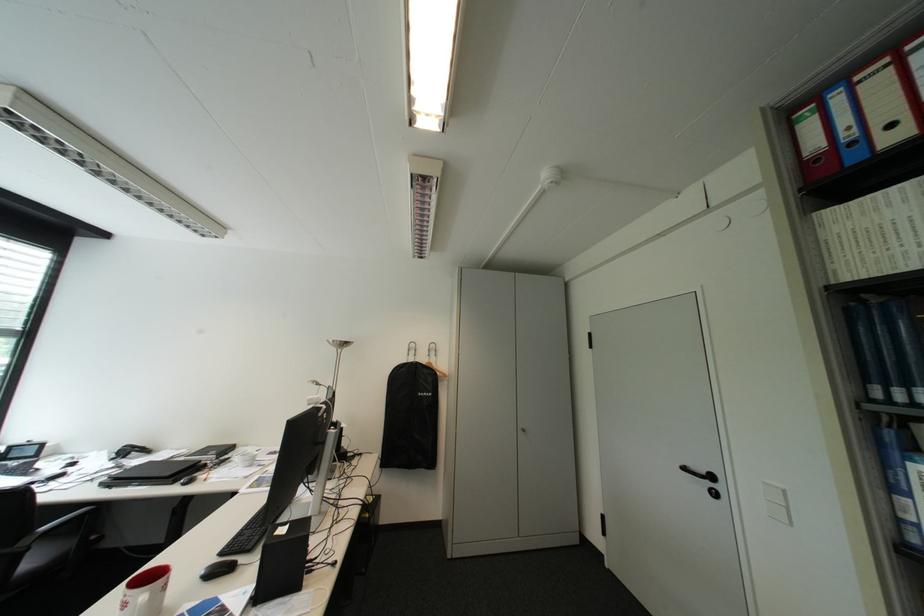
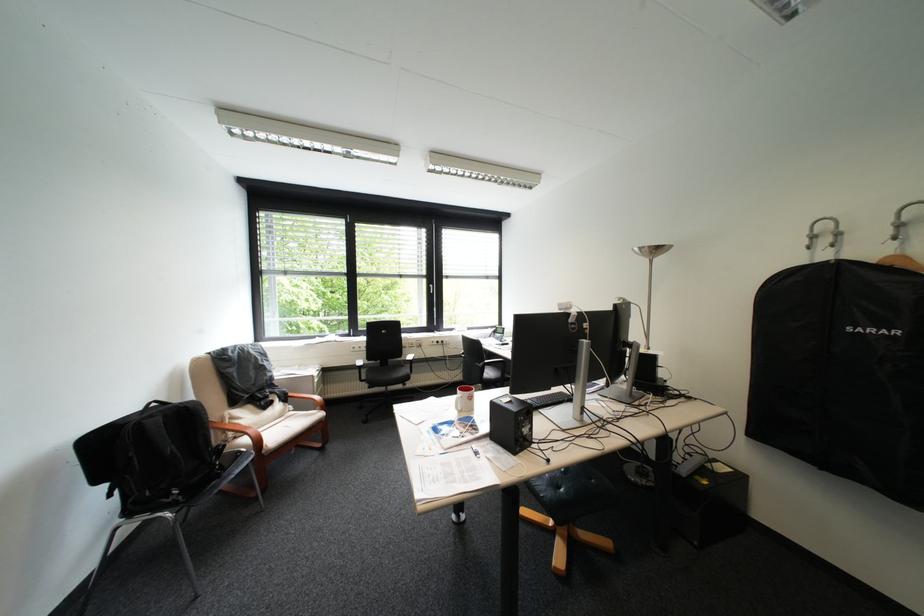
Question: How did the camera likely rotate?

Choices:
 (A) Left
 (B) Right
 (C) Up
 (D) Down

Answer: (A)